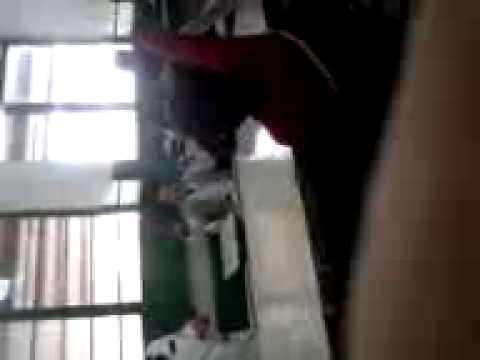
Find the location of a particular element. The width and height of the screenshot is (480, 360). white table is located at coordinates (279, 219).